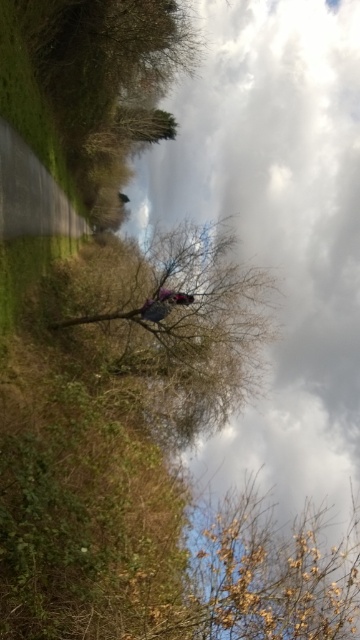
You are standing at point A and want to walk to point B. Which direction should you go? The coordinates are given as point A at (240,70) and point B at (177,413).

To go from point A at (240,70) to point B at (177,413), you should move towards the northeast direction since point B has a higher x and lower y coordinate compared to point A.

You are standing in the middle of the rural area looking at the cloudy sky at upper center and the brown textured tree at center. Which object is positioned to the right side of the other?

The cloudy sky at upper center is positioned to the right of the brown textured tree at center.

You are an artist planning to paint the scene. You need to decide where to place the horizon line so that the cloudy sky at upper center and the brown textured tree at center are both visible. Based on their sizes in the image, where should you place the horizon line?

The cloudy sky at upper center is much taller than the brown textured tree at center, so the horizon line should be placed lower to ensure both the sky and the tree are fully visible.